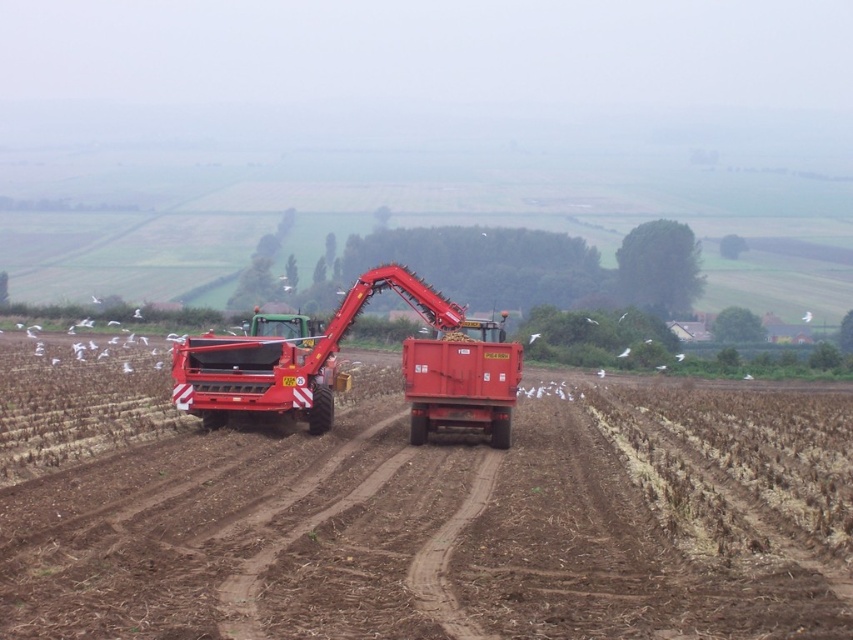
You are a farmer standing at the edge of the field. You see the matte red trailer truck at center and the white feathered bird at center. Which object is nearer to you?

The matte red trailer truck at center is closer to the viewer than the white feathered bird at center.

You are a farmer checking the field conditions. There is a point at coordinates (456, 524) in the image. What is located at that point?

The point at coordinates (456, 524) is occupied by the dirt field at center.

Consider the image. You are a farmer who needs to transport harvested crops. You have a matte red trailer truck at center and a dirt field at center. Which object should you use to carry the crops?

The matte red trailer truck at center is designed for transporting harvested materials, so you should use the matte red trailer truck at center to carry the crops.